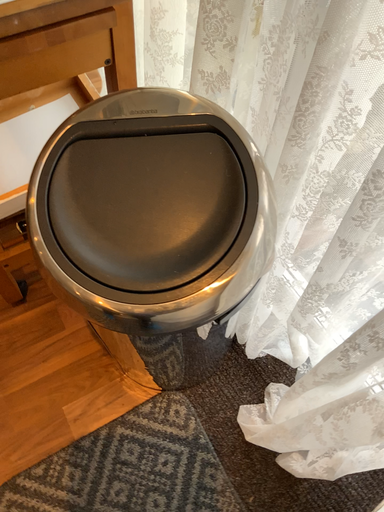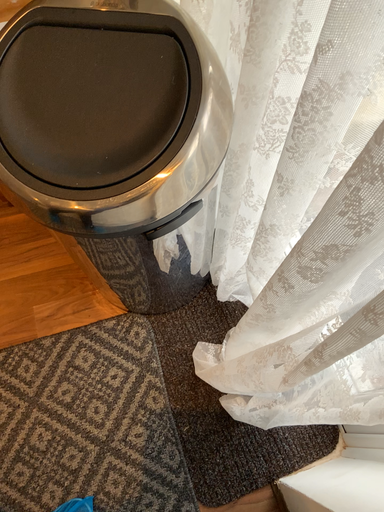
Question: How did the camera likely rotate when shooting the video?

Choices:
 (A) rotated right
 (B) rotated left

Answer: (B)